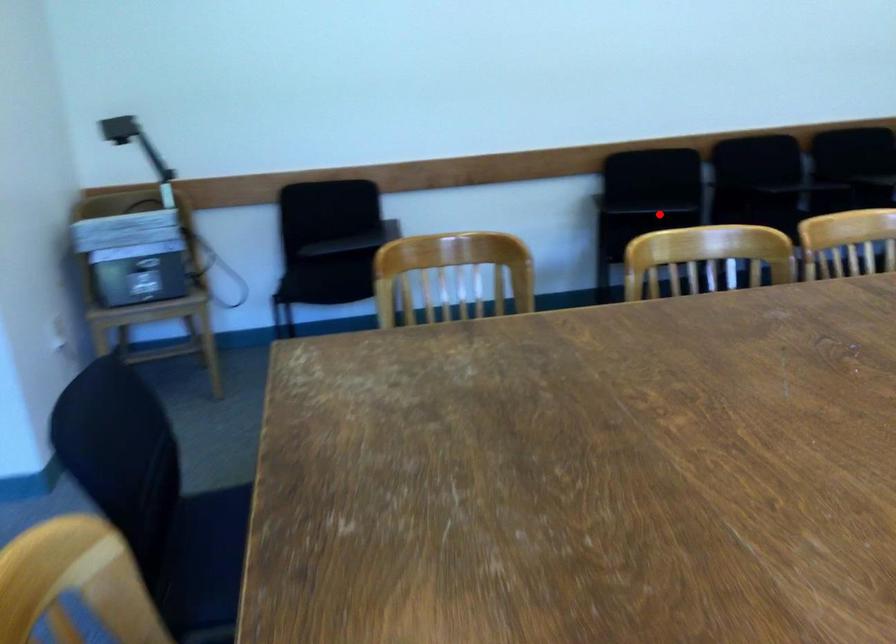
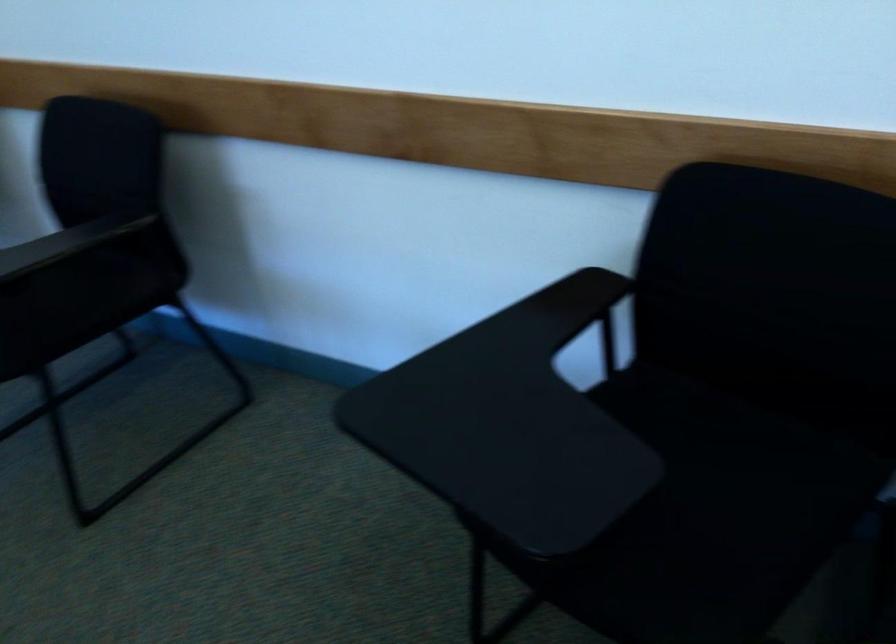
Locate, in the second image, the point that corresponds to the highlighted location in the first image.

(743, 457)